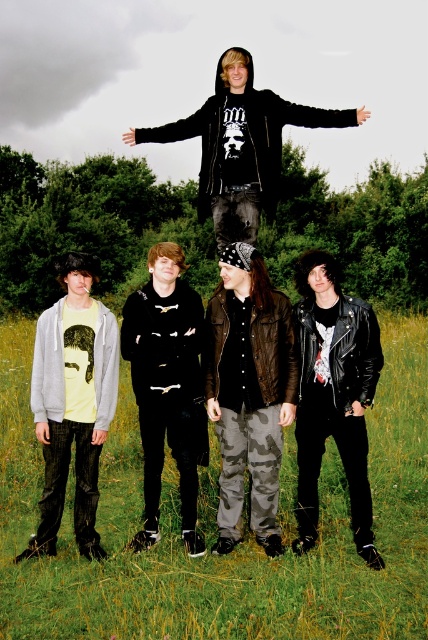
Find the location of a particular element. This screenshot has width=428, height=640. leather jacket at center is located at coordinates (333, 394).

Between leather jacket at center and black leather jacket at center, which one is positioned higher?

black leather jacket at center

Where is `leather jacket at center`? This screenshot has width=428, height=640. leather jacket at center is located at coordinates (333, 394).

The image size is (428, 640). In order to click on leather jacket at center in this screenshot , I will do `click(333, 394)`.

Does camouflage pants at center have a greater height compared to black matte hoodie at upper center?

Correct, camouflage pants at center is much taller as black matte hoodie at upper center.

Which is more to the left, camouflage pants at center or black matte hoodie at upper center?

From the viewer's perspective, black matte hoodie at upper center appears more on the left side.

You are a GUI agent. You are given a task and a screenshot of the screen. Output one action in this format:
    pyautogui.click(x=<x>, y=<y>)
    Task: Click on the camouflage pants at center
    
    Given the screenshot: What is the action you would take?
    pyautogui.click(x=249, y=392)

Between green grass at lower center and black matte hoodie at upper center, which one appears on the left side from the viewer's perspective?

From the viewer's perspective, green grass at lower center appears more on the left side.

Based on the photo, can you confirm if green grass at lower center is thinner than black matte hoodie at upper center?

No.

Locate an element on the screen. green grass at lower center is located at coordinates (214, 529).